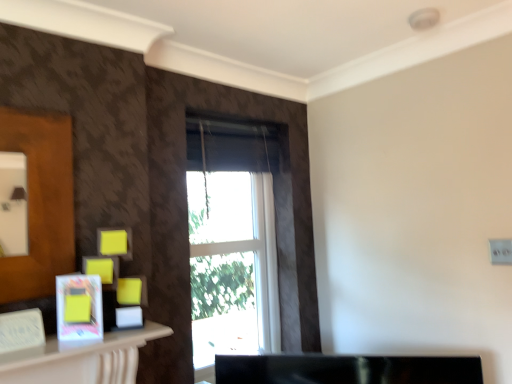
The width and height of the screenshot is (512, 384). What do you see at coordinates (79, 307) in the screenshot? I see `matte white picture frame at lower left` at bounding box center [79, 307].

At what (x,y) coordinates should I click in order to perform the action: click on matte white picture frame at lower left. Please return your answer as a coordinate pair (x, y). This screenshot has height=384, width=512. Looking at the image, I should click on 79,307.

What is the approximate width of white glass window at center?

white glass window at center is 5.42 inches in width.

Describe the element at coordinates (233, 235) in the screenshot. This screenshot has width=512, height=384. I see `white glass window at center` at that location.

What are the coordinates of `white glass window at center` in the screenshot? It's located at (233, 235).

At what (x,y) coordinates should I click in order to perform the action: click on matte white picture frame at lower left. Please return your answer as a coordinate pair (x, y). Image resolution: width=512 pixels, height=384 pixels. Looking at the image, I should click on (79, 307).

Which is more to the right, white glass window at center or matte white picture frame at lower left?

white glass window at center.

Is white glass window at center closer to camera compared to matte white picture frame at lower left?

No, white glass window at center is behind matte white picture frame at lower left.

Considering the points (273, 336) and (65, 320), which point is in front, point (273, 336) or point (65, 320)?

The point (65, 320) is closer.

From the image's perspective, is white glass window at center above or below matte white picture frame at lower left?

Based on their image positions, white glass window at center is located above matte white picture frame at lower left.

From a real-world perspective, is white glass window at center on top of matte white picture frame at lower left?

Correct, in the physical world, white glass window at center is higher than matte white picture frame at lower left.

Can you confirm if white glass window at center is wider than matte white picture frame at lower left?

Indeed, white glass window at center has a greater width compared to matte white picture frame at lower left.

Can you confirm if white glass window at center is taller than matte white picture frame at lower left?

Correct, white glass window at center is much taller as matte white picture frame at lower left.

In terms of size, does white glass window at center appear bigger or smaller than matte white picture frame at lower left?

Clearly, white glass window at center is larger in size than matte white picture frame at lower left.

Looking at this image, is matte white picture frame at lower left surrounded by white glass window at center?

No.

Is white glass window at center far away from matte white picture frame at lower left?

That's not correct — white glass window at center is a little close to matte white picture frame at lower left.

Does white glass window at center turn towards matte white picture frame at lower left?

No, white glass window at center is not turned towards matte white picture frame at lower left.

You are a GUI agent. You are given a task and a screenshot of the screen. Output one action in this format:
    pyautogui.click(x=<x>, y=<y>)
    Task: Click on the window lying above the matte white picture frame at lower left (from the image's perspective)
    The image size is (512, 384).
    Given the screenshot: What is the action you would take?
    pyautogui.click(x=233, y=235)

Does matte white picture frame at lower left appear on the right side of white glass window at center?

Incorrect, matte white picture frame at lower left is not on the right side of white glass window at center.

Is the depth of matte white picture frame at lower left greater than that of white glass window at center?

No, the depth of matte white picture frame at lower left is less than that of white glass window at center.

Is point (86, 316) positioned in front of point (252, 345)?

That is True.

From the image's perspective, is matte white picture frame at lower left below white glass window at center?

Indeed, from the image's perspective, matte white picture frame at lower left is shown beneath white glass window at center.

From a real-world perspective, which is physically above, matte white picture frame at lower left or white glass window at center?

In real-world perspective, white glass window at center is above.

Looking at their sizes, would you say matte white picture frame at lower left is wider or thinner than white glass window at center?

Clearly, matte white picture frame at lower left has less width compared to white glass window at center.

Between matte white picture frame at lower left and white glass window at center, which one has more height?

white glass window at center is taller.

Does matte white picture frame at lower left have a smaller size compared to white glass window at center?

Indeed, matte white picture frame at lower left has a smaller size compared to white glass window at center.

Would you say matte white picture frame at lower left is outside white glass window at center?

Absolutely, matte white picture frame at lower left is external to white glass window at center.

Is matte white picture frame at lower left not close to white glass window at center?

They are positioned close to each other.

Is matte white picture frame at lower left oriented away from white glass window at center?

No, matte white picture frame at lower left is not facing the opposite direction of white glass window at center.

Can you tell me how much matte white picture frame at lower left and white glass window at center differ in facing direction?

matte white picture frame at lower left and white glass window at center are facing 39.1 degrees away from each other.

Where is `window located on the right of matte white picture frame at lower left`? The height and width of the screenshot is (384, 512). window located on the right of matte white picture frame at lower left is located at coordinates (233, 235).

Where is `window located behind the matte white picture frame at lower left`? The width and height of the screenshot is (512, 384). window located behind the matte white picture frame at lower left is located at coordinates (233, 235).

The height and width of the screenshot is (384, 512). I want to click on picture frame below the white glass window at center (from a real-world perspective), so click(79, 307).